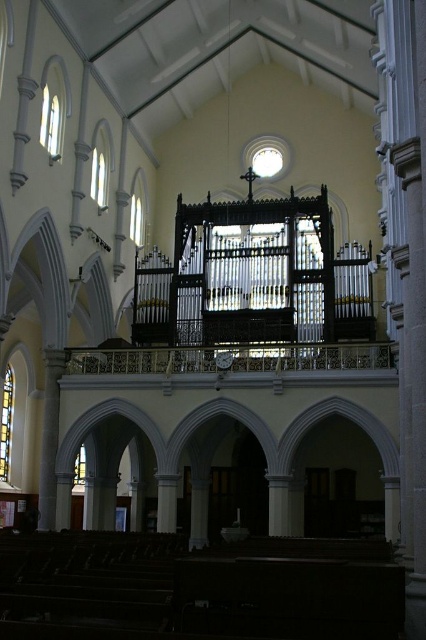
Does point (60, 132) come closer to viewer compared to point (106, 147)?

Yes, it is.

Between point (57, 115) and point (92, 168), which one is positioned behind?

Positioned behind is point (92, 168).

Who is more distant from viewer, [43,108] or [108,157]?

Positioned behind is point [108,157].

Identify the location of transparent glass window at upper left. Image resolution: width=426 pixels, height=640 pixels. (52, 108).

Which of these two, polished brass pipe organ at center or stained glass window at left, stands shorter?

stained glass window at left is shorter.

From the picture: Between polished brass pipe organ at center and stained glass window at left, which one is positioned lower?

Positioned lower is stained glass window at left.

Between point (221, 324) and point (9, 428), which one is positioned in front?

Point (221, 324) is more forward.

You are a GUI agent. You are given a task and a screenshot of the screen. Output one action in this format:
    pyautogui.click(x=<x>, y=<y>)
    Task: Click on the polished brass pipe organ at center
    
    Given the screenshot: What is the action you would take?
    pyautogui.click(x=253, y=278)

Can you confirm if clear glass window at upper left is positioned above transparent stained glass at lower left?

Yes, clear glass window at upper left is above transparent stained glass at lower left.

Does clear glass window at upper left have a greater width compared to transparent stained glass at lower left?

No, clear glass window at upper left is not wider than transparent stained glass at lower left.

Who is more forward, [94,172] or [83,474]?

Point [94,172] is more forward.

Where is `clear glass window at upper left`? clear glass window at upper left is located at coordinates (100, 164).